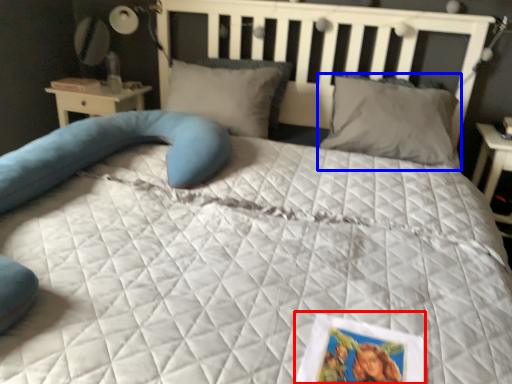
Question: Which object appears closest to the camera in this image, postcard (highlighted by a red box) or pillow (highlighted by a blue box)?

Choices:
 (A) postcard
 (B) pillow

Answer: (A)